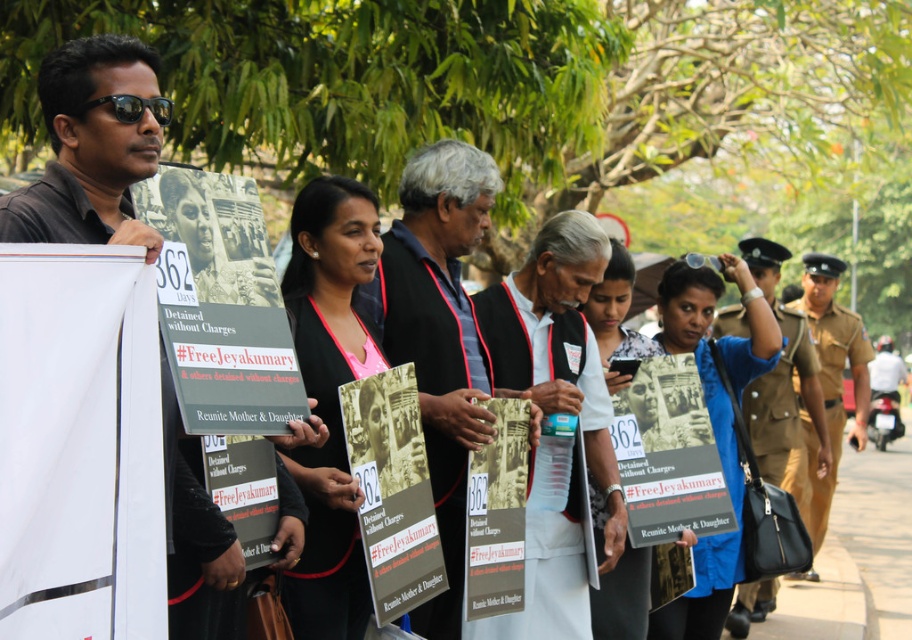
Does matte black sign at center appear under khaki uniform at center?

Indeed, matte black sign at center is positioned under khaki uniform at center.

Is matte black sign at center closer to camera compared to khaki uniform at center?

Yes.

Find the location of a particular element. This screenshot has height=640, width=912. matte black sign at center is located at coordinates (329, 397).

Is matte black shirt at left positioned at the back of matte black signboard at center?

No, it is not.

Does point (140, 115) lie behind point (614, 577)?

No.

Where is `matte black shirt at left`? The width and height of the screenshot is (912, 640). matte black shirt at left is located at coordinates (92, 145).

Does matte black sign at center have a greater height compared to brown uniform at right?

Incorrect, matte black sign at center's height is not larger of brown uniform at right's.

Who is more forward, [313,320] or [827,317]?

Point [313,320] is more forward.

You are a GUI agent. You are given a task and a screenshot of the screen. Output one action in this format:
    pyautogui.click(x=<x>, y=<y>)
    Task: Click on the matte black sign at center
    
    Given the screenshot: What is the action you would take?
    pyautogui.click(x=329, y=397)